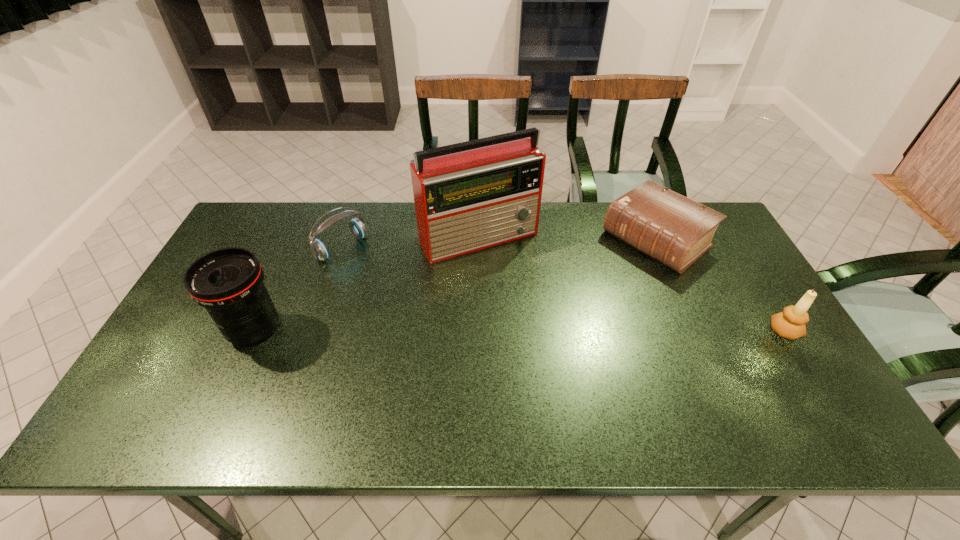
Image resolution: width=960 pixels, height=540 pixels. I want to click on object located in the left edge section of the desktop, so click(228, 282).

Where is `candle_holder situated at the right edge`? Image resolution: width=960 pixels, height=540 pixels. candle_holder situated at the right edge is located at coordinates (790, 324).

This screenshot has width=960, height=540. Find the location of `Bible that is at the right edge`. Bible that is at the right edge is located at coordinates (676, 231).

Find the location of a particular element. This screenshot has height=540, width=960. object that is at the far right corner is located at coordinates (676, 231).

Identify the location of free space at the far edge of the desktop. The height and width of the screenshot is (540, 960). (564, 220).

Locate an element on the screen. vacant space at the near edge of the desktop is located at coordinates (290, 376).

At what (x,y) coordinates should I click in order to perform the action: click on vacant space at the left edge of the desktop. Please return your answer as a coordinate pair (x, y). The height and width of the screenshot is (540, 960). Looking at the image, I should click on (196, 338).

What are the coordinates of `vacant space at the far left corner` in the screenshot? It's located at (297, 207).

At what (x,y) coordinates should I click in order to perform the action: click on vacant space at the near right corner. Please return your answer as a coordinate pair (x, y). Looking at the image, I should click on (787, 370).

This screenshot has height=540, width=960. Find the location of `free space between the telephoto lens and the tallest object`. free space between the telephoto lens and the tallest object is located at coordinates (367, 284).